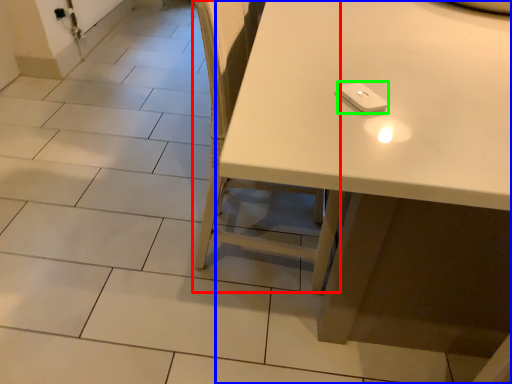
Question: Which object is the farthest from chair (highlighted by a red box)? Choose among these: table (highlighted by a blue box) or Wii controller (highlighted by a green box).

Choices:
 (A) table
 (B) Wii controller

Answer: (B)